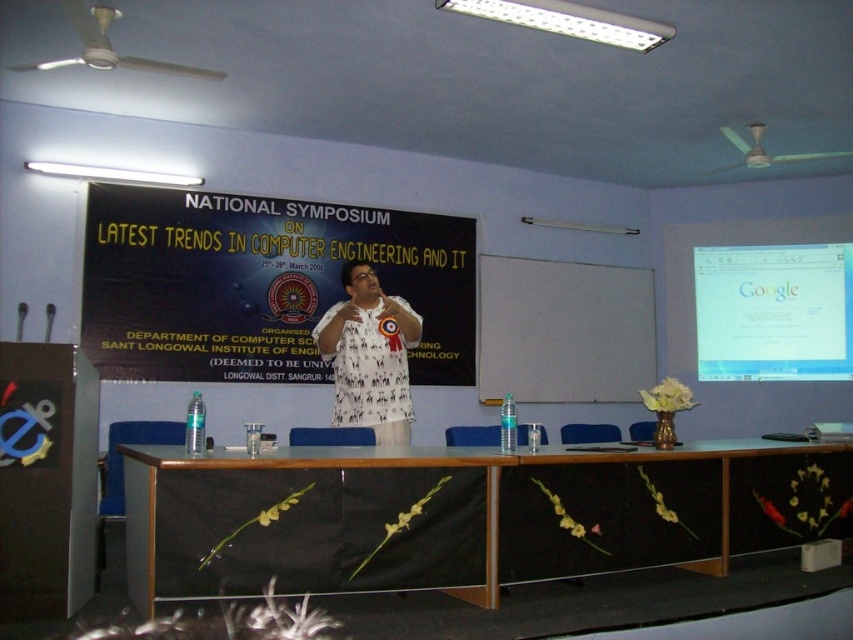
You are an event coordinator at the National Symposium. You need to ensure that the black matte banner at center is visible to all attendees. Given that the white glossy projector screen at upper right is already set up, what should you do to ensure the banner remains visible?

The black matte banner at center is in front of the white glossy projector screen at upper right, so to ensure visibility, you should avoid projecting images onto the screen that would obscure the banner or adjust the screen position to prevent it from blocking the banner.

You are attending the National Symposium on Latest Trends in Computer Engineering and IT at Sant Longowal Institute of Engineering and Technology. You notice two points marked in the image. The first point is at coordinates point (x=447, y=554) and the second is at point (x=791, y=252). Which point is closer to you as you look at the image?

Point (x=447, y=554) is closer to the camera than point (x=791, y=252), so the first point is closer to you.

Consider the image. You are an event organizer setting up for the symposium. You need to ensure that the black wood table at center is visible to all attendees. Considering the white glossy projector screen at upper right, will the table be obscured by the screen?

The black wood table at center is shorter than the white glossy projector screen at upper right, so the table will not be obscured by the screen as it is shorter in height.